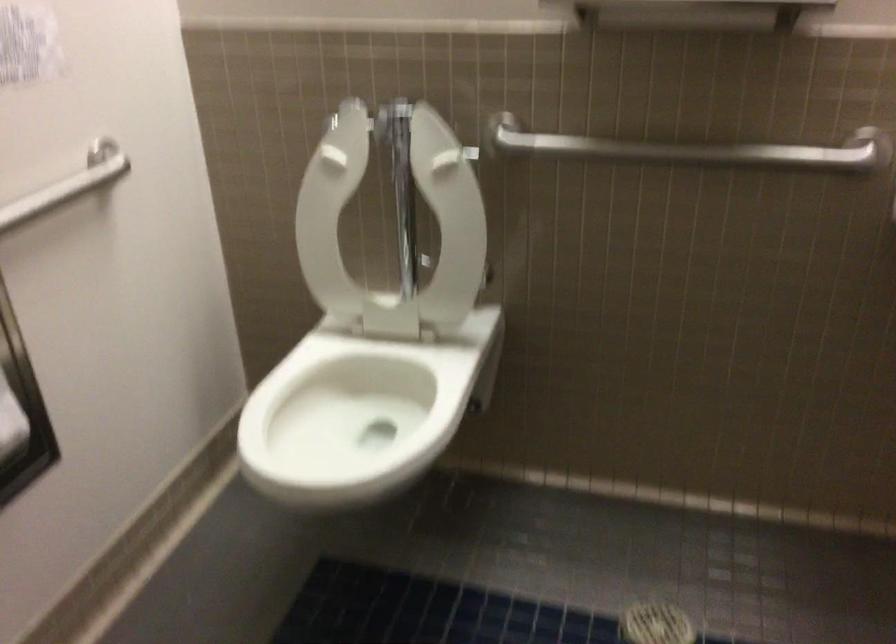
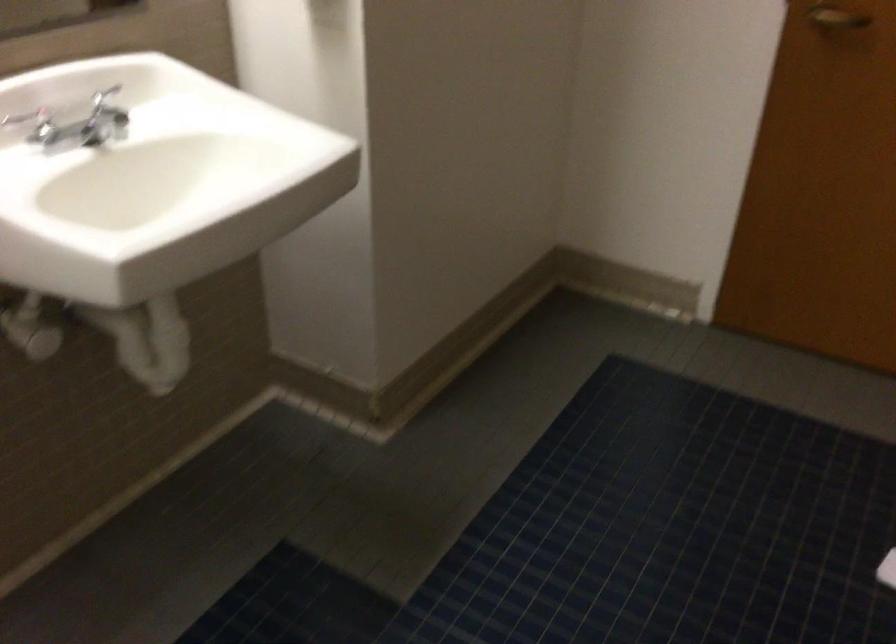
Based on the continuous images, in which direction is the camera rotating?

The camera's rotation is toward right-down.